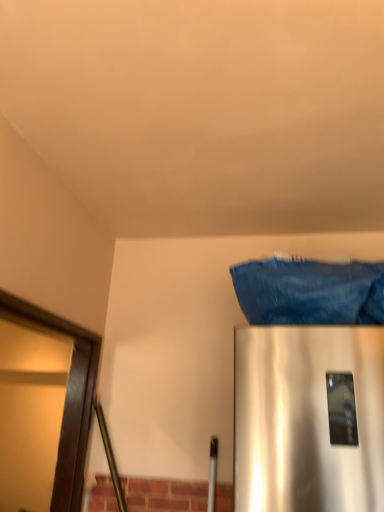
Question: Are denim fabric at upper right and dark brown wooden frame at left making contact?

Choices:
 (A) yes
 (B) no

Answer: (B)

Question: Is denim fabric at upper right facing towards dark brown wooden frame at left?

Choices:
 (A) no
 (B) yes

Answer: (A)

Question: Are denim fabric at upper right and dark brown wooden frame at left located far from each other?

Choices:
 (A) no
 (B) yes

Answer: (A)

Question: Can you confirm if denim fabric at upper right is positioned to the left of dark brown wooden frame at left?

Choices:
 (A) yes
 (B) no

Answer: (B)

Question: From the image's perspective, is denim fabric at upper right over dark brown wooden frame at left?

Choices:
 (A) no
 (B) yes

Answer: (B)

Question: From a real-world perspective, is denim fabric at upper right over dark brown wooden frame at left?

Choices:
 (A) no
 (B) yes

Answer: (B)

Question: Is denim fabric at upper right at the back of dark brown wooden frame at left?

Choices:
 (A) yes
 (B) no

Answer: (B)

Question: Is dark brown wooden frame at left positioned before denim fabric at upper right?

Choices:
 (A) yes
 (B) no

Answer: (A)

Question: Is dark brown wooden frame at left to the right of denim fabric at upper right from the viewer's perspective?

Choices:
 (A) yes
 (B) no

Answer: (B)

Question: From the image's perspective, is dark brown wooden frame at left beneath denim fabric at upper right?

Choices:
 (A) yes
 (B) no

Answer: (A)

Question: Does dark brown wooden frame at left have a lesser height compared to denim fabric at upper right?

Choices:
 (A) yes
 (B) no

Answer: (B)

Question: Is dark brown wooden frame at left surrounding denim fabric at upper right?

Choices:
 (A) yes
 (B) no

Answer: (B)

Question: From a real-world perspective, is denim fabric at upper right above or below dark brown wooden frame at left?

Choices:
 (A) above
 (B) below

Answer: (A)